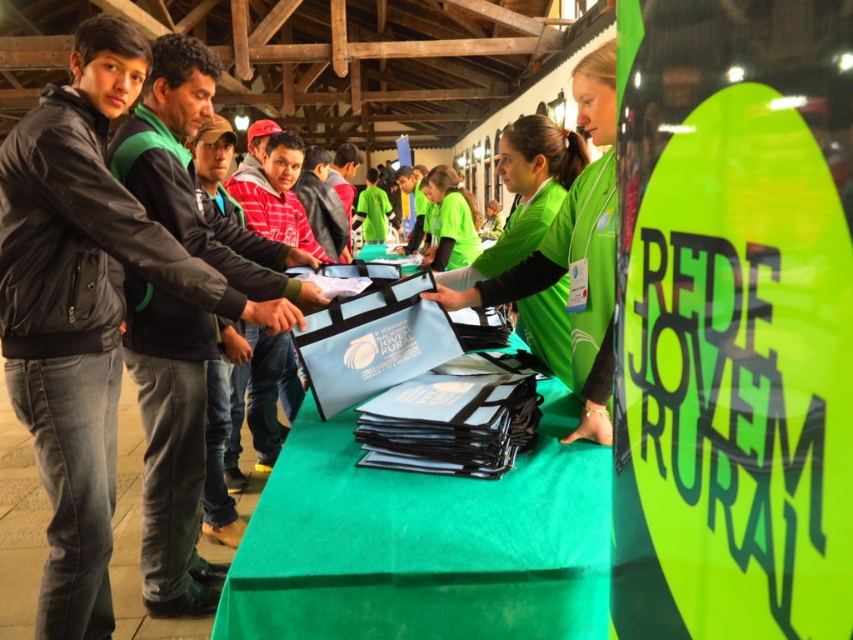
Which is below, green fleece jacket at left or green matte vest at center?

green fleece jacket at left is lower down.

Is green fleece jacket at left smaller than green matte vest at center?

No.

Measure the distance between point (216, 262) and camera.

Point (216, 262) is 2.09 meters from camera.

Identify the location of green fleece jacket at left. The width and height of the screenshot is (853, 640). (171, 445).

Can you confirm if green matte vest at center is wider than green fabric shirt at center?

Yes.

Can you confirm if green matte vest at center is positioned to the left of green fabric shirt at center?

Incorrect, green matte vest at center is not on the left side of green fabric shirt at center.

Measure the distance between point [596,259] and camera.

The distance of point [596,259] from camera is 1.63 meters.

In order to click on green matte vest at center in this screenshot , I will do `click(573, 252)`.

Between green fleece jacket at left and green fabric shirt at center, which one appears on the left side from the viewer's perspective?

Positioned to the left is green fleece jacket at left.

Image resolution: width=853 pixels, height=640 pixels. I want to click on green fleece jacket at left, so click(x=171, y=445).

You are a GUI agent. You are given a task and a screenshot of the screen. Output one action in this format:
    pyautogui.click(x=<x>, y=<y>)
    Task: Click on the green fleece jacket at left
    This screenshot has height=640, width=853.
    Given the screenshot: What is the action you would take?
    pyautogui.click(x=171, y=445)